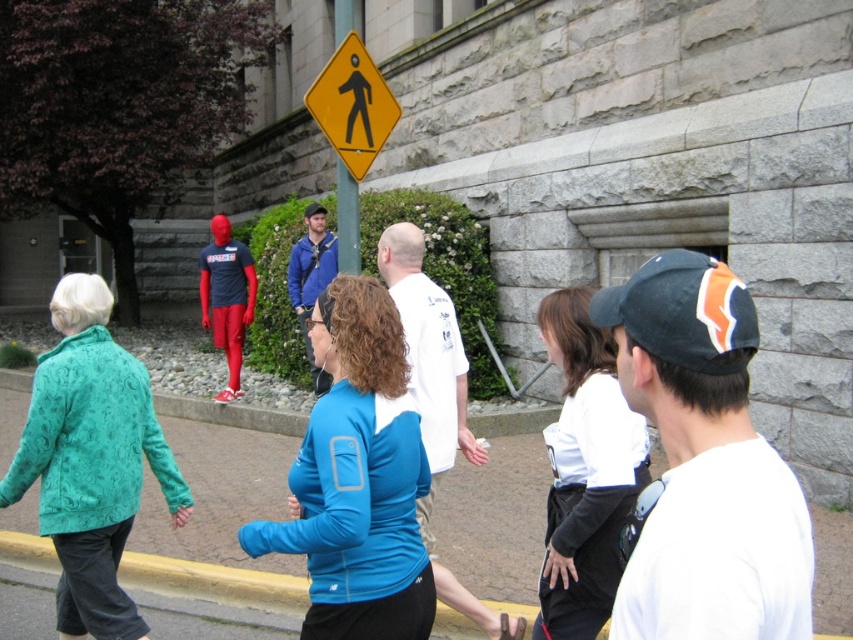
Is teal textured jacket at lower left bigger than white cotton shirt at center?

Yes.

Is teal textured jacket at lower left wider than white cotton shirt at center?

Correct, the width of teal textured jacket at lower left exceeds that of white cotton shirt at center.

Image resolution: width=853 pixels, height=640 pixels. I want to click on teal textured jacket at lower left, so (x=91, y=460).

Identify the location of teal textured jacket at lower left. Image resolution: width=853 pixels, height=640 pixels. (91, 460).

Is point (532, 515) more distant than point (543, 612)?

Yes, it is.

At what (x,y) coordinates should I click in order to perform the action: click on blue fabric at center. Please return your answer as a coordinate pair (x, y). Looking at the image, I should click on [218, 493].

Does blue fabric shirt at center appear on the right side of blue fabric at center?

Yes, blue fabric shirt at center is to the right of blue fabric at center.

Is blue fabric shirt at center further to the viewer compared to blue fabric at center?

No, blue fabric shirt at center is in front of blue fabric at center.

The height and width of the screenshot is (640, 853). Identify the location of blue fabric shirt at center. [357, 477].

This screenshot has width=853, height=640. In order to click on blue fabric shirt at center in this screenshot , I will do `click(357, 477)`.